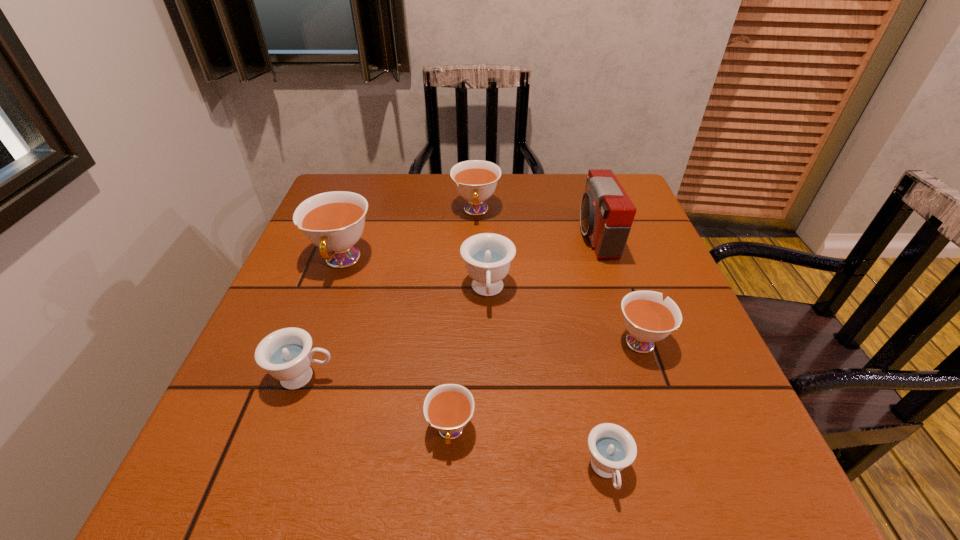
The height and width of the screenshot is (540, 960). Find the location of `the leftmost blue teacup`. the leftmost blue teacup is located at coordinates (286, 354).

You are a GUI agent. You are given a task and a screenshot of the screen. Output one action in this format:
    pyautogui.click(x=<x>, y=<y>)
    Task: Click on the nearest white teacup
    
    Given the screenshot: What is the action you would take?
    pyautogui.click(x=448, y=407)

Locate an element on the screen. The width and height of the screenshot is (960, 540). the rightmost blue teacup is located at coordinates (612, 448).

I want to click on the second teacup from right to left, so click(x=612, y=448).

The width and height of the screenshot is (960, 540). I want to click on free space located on the front-facing side of the camera, so click(x=451, y=235).

Identify the location of vacant space located 0.250m on the front-facing side of the camera. (479, 235).

Find the location of `blank space located 0.120m on the front-facing side of the camera`. blank space located 0.120m on the front-facing side of the camera is located at coordinates (531, 235).

Locate an element on the screen. This screenshot has height=540, width=960. free space located 0.120m on the side of the biggest white teacup with the handle is located at coordinates (318, 328).

Identify the location of vacant space located 0.130m on the side of the farthest white teacup with the handle. (475, 259).

At what (x,y) coordinates should I click in order to perform the action: click on free space located 0.200m on the side of the biggest blue teacup with the handle. Please return your answer as a coordinate pair (x, y). This screenshot has height=540, width=960. Looking at the image, I should click on tap(490, 403).